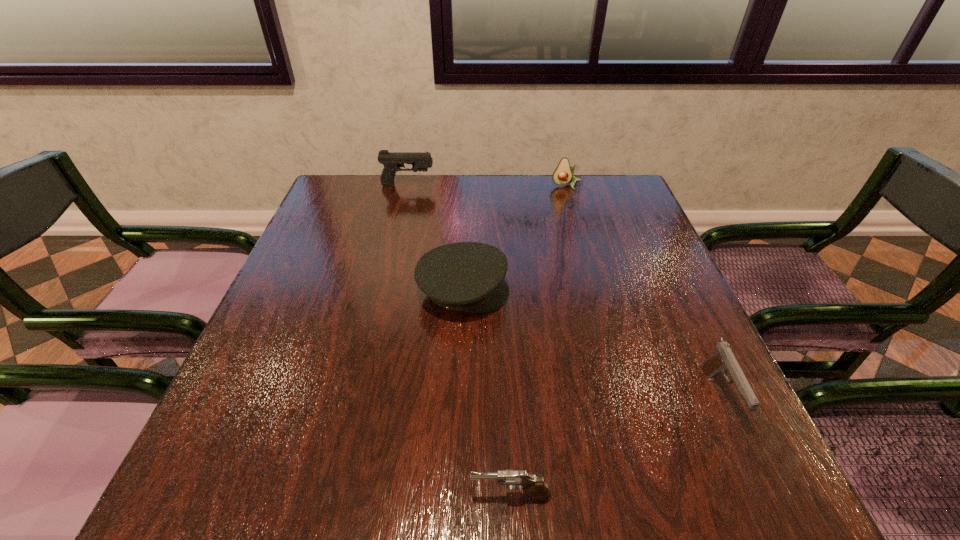
In order to click on the leftmost pistol in this screenshot , I will do `click(392, 161)`.

Identify the location of the farthest pistol. This screenshot has width=960, height=540. (392, 161).

Where is `avocado`? avocado is located at coordinates (563, 174).

This screenshot has width=960, height=540. I want to click on the third farthest object, so click(x=466, y=276).

Locate an element on the screen. The height and width of the screenshot is (540, 960). the second tallest pistol is located at coordinates (723, 360).

Locate an element on the screen. the rightmost object is located at coordinates click(723, 360).

The height and width of the screenshot is (540, 960). Identify the location of the shortest object. (514, 479).

Find the location of `the second pistol from right to left`. the second pistol from right to left is located at coordinates (514, 479).

Where is `blank space located 0.250m at the barrel of the leftmost pistol`? This screenshot has height=540, width=960. blank space located 0.250m at the barrel of the leftmost pistol is located at coordinates (516, 185).

Identify the location of vacant area situated 0.130m on the seed side of the avocado. tap(574, 214).